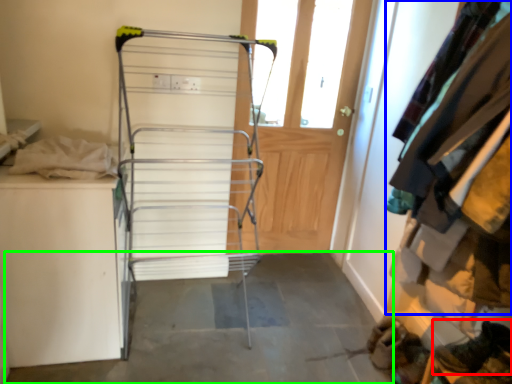
Question: Based on their relative distances, which object is nearer to footwear (highlighted by a red box)? Choose from clothing (highlighted by a blue box) and concrete (highlighted by a green box).

Choices:
 (A) clothing
 (B) concrete

Answer: (A)